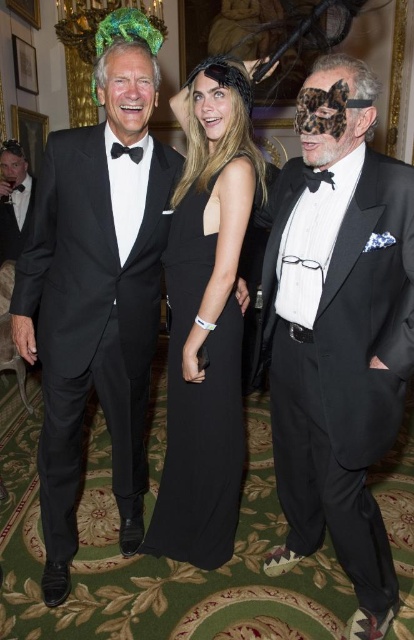
You are at the point labeled point (5, 160). You want to walk to the point labeled point (117, 145). Is there a clear path between these two points without needing to go around any obstacles?

Yes, there is a clear path between point (5, 160) and point (117, 145) because the first point is behind the second point, so you can walk directly towards it without obstacles.

You are a photographer at a formal event. You need to adjust the lighting to ensure both the matte black tuxedo at left and the black satin bow tie at left are well lit. Given their distance apart, will you need to adjust the lighting for each separately?

The matte black tuxedo at left and the black satin bow tie at left are 3.74 meters apart from each other. Since they are separated by a significant distance, you will need to adjust the lighting for each separately to ensure proper illumination.

You are standing at the origin point of the coordinate system in the image. The black satin tuxedo at left is located at point (96,289). Can you determine the direction of the black satin tuxedo at left relative to your position?

The black satin tuxedo at left is located at point (96,289) in the coordinate system, which means it is to the northeast of your position at the origin.